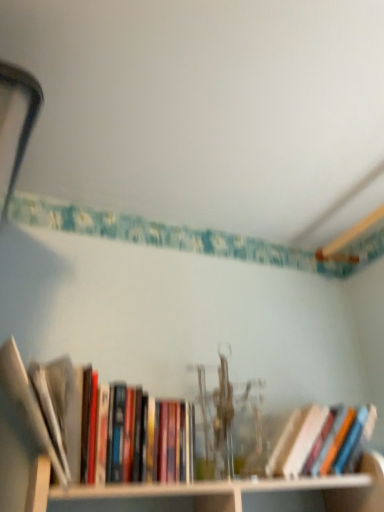
Question: Is hardcover books at left, which ranks as the 1th book in left-to-right order, positioned with its back to hardcover book at center, positioned as the first book in right-to-left order?

Choices:
 (A) yes
 (B) no

Answer: (B)

Question: From the image's perspective, is hardcover books at left, which ranks as the 1th book in left-to-right order, over hardcover book at center, the 2th book positioned from the left?

Choices:
 (A) no
 (B) yes

Answer: (B)

Question: From the image's perspective, is hardcover books at left, which ranks as the 1th book in left-to-right order, located beneath hardcover book at center, the 2th book positioned from the left?

Choices:
 (A) yes
 (B) no

Answer: (B)

Question: Can you confirm if hardcover books at left, the 2th book from the right, is positioned to the left of hardcover book at center, positioned as the first book in right-to-left order?

Choices:
 (A) no
 (B) yes

Answer: (B)

Question: From a real-world perspective, is hardcover books at left, the 2th book from the right, positioned over hardcover book at center, positioned as the first book in right-to-left order, based on gravity?

Choices:
 (A) no
 (B) yes

Answer: (B)

Question: In terms of width, does hardcover book at center, the 2th book positioned from the left, look wider or thinner when compared to hardcover books at left, the 2th book from the right?

Choices:
 (A) wide
 (B) thin

Answer: (B)

Question: From a real-world perspective, is hardcover book at center, the 2th book positioned from the left, above or below hardcover books at left, the 2th book from the right?

Choices:
 (A) above
 (B) below

Answer: (B)

Question: Looking at the image, does hardcover book at center, the 2th book positioned from the left, seem bigger or smaller compared to hardcover books at left, the 2th book from the right?

Choices:
 (A) small
 (B) big

Answer: (A)

Question: Is hardcover book at center, positioned as the first book in right-to-left order, inside or outside of hardcover books at left, the 2th book from the right?

Choices:
 (A) inside
 (B) outside

Answer: (B)

Question: In terms of size, does hardcover books at left, which ranks as the 1th book in left-to-right order, appear bigger or smaller than hardcover book at center, positioned as the first book in right-to-left order?

Choices:
 (A) small
 (B) big

Answer: (B)

Question: Would you say hardcover books at left, the 2th book from the right, is to the left or to the right of hardcover book at center, the 2th book positioned from the left, in the picture?

Choices:
 (A) left
 (B) right

Answer: (A)

Question: Considering their positions, is hardcover books at left, the 2th book from the right, located in front of or behind hardcover book at center, positioned as the first book in right-to-left order?

Choices:
 (A) behind
 (B) front

Answer: (B)

Question: Is hardcover books at left, the 2th book from the right, wider or thinner than hardcover book at center, positioned as the first book in right-to-left order?

Choices:
 (A) wide
 (B) thin

Answer: (A)

Question: Is hardcover book at center, positioned as the first book in right-to-left order, taller or shorter than white wood cabinet at lower center?

Choices:
 (A) tall
 (B) short

Answer: (A)

Question: In terms of size, does hardcover book at center, positioned as the first book in right-to-left order, appear bigger or smaller than white wood cabinet at lower center?

Choices:
 (A) big
 (B) small

Answer: (B)